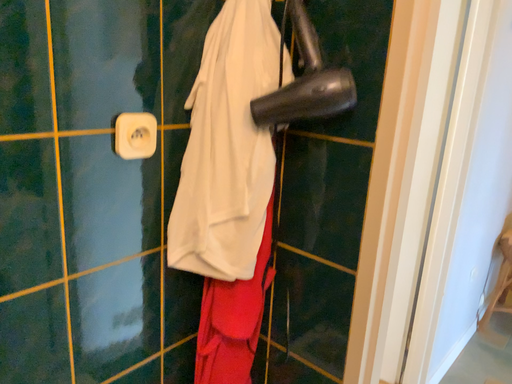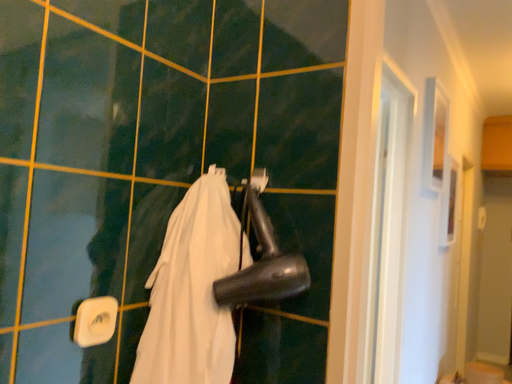
Question: Which way did the camera rotate in the video?

Choices:
 (A) rotated downward
 (B) rotated upward

Answer: (B)